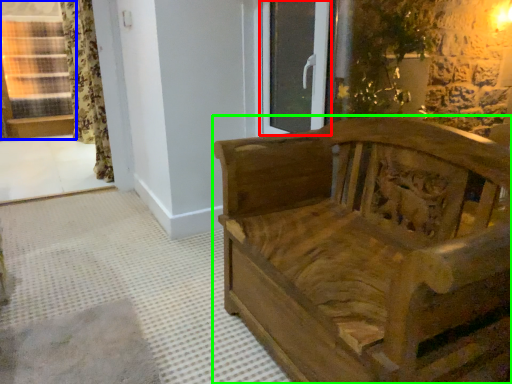
Question: Based on their relative distances, which object is nearer to glass door (highlighted by a red box)? Choose from window (highlighted by a blue box) and furniture (highlighted by a green box).

Choices:
 (A) window
 (B) furniture

Answer: (B)